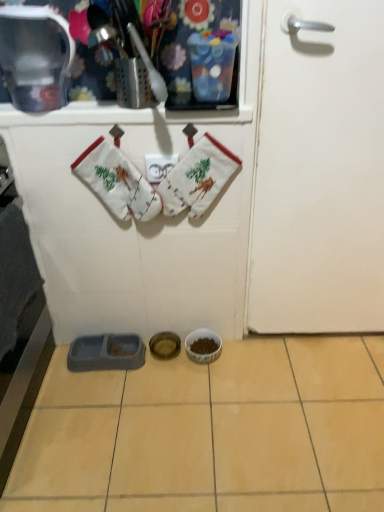
In the image, there is a metallic silver container at upper left. From a real-world perspective, find a few locations in the empty space that is ontop of metallic silver container at upper left. Your answer should be formatted as a list of tuples, i.e. [(x1, y1)], where each tuple contains the x and y coordinates of a point satisfying the conditions above.

[(0.066, -0.000)]